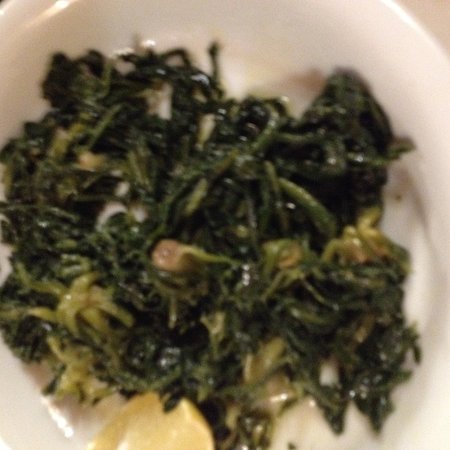
The width and height of the screenshot is (450, 450). I want to click on plate, so click(347, 47), click(266, 47).